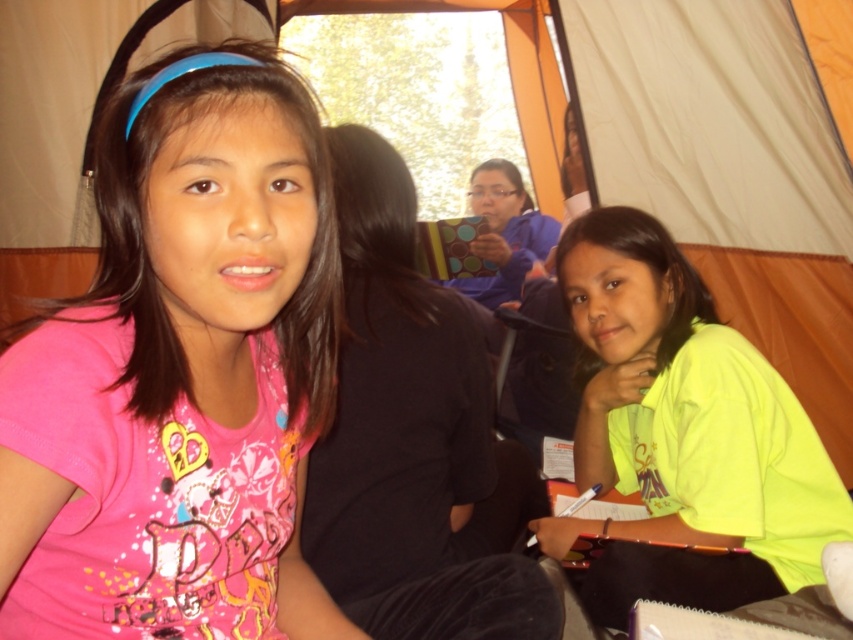
Question: Which point is farther from the camera taking this photo?

Choices:
 (A) (724, 417)
 (B) (94, 369)

Answer: (A)

Question: Among these objects, which one is farthest from the camera?

Choices:
 (A) pink fabric shirt at center
 (B) neon yellow shirt at right

Answer: (B)

Question: Is pink fabric shirt at center thinner than neon yellow shirt at right?

Choices:
 (A) no
 (B) yes

Answer: (B)

Question: Considering the relative positions of pink fabric shirt at center and neon yellow shirt at right in the image provided, where is pink fabric shirt at center located with respect to neon yellow shirt at right?

Choices:
 (A) below
 (B) above

Answer: (B)

Question: Is pink fabric shirt at center above neon yellow shirt at right?

Choices:
 (A) yes
 (B) no

Answer: (A)